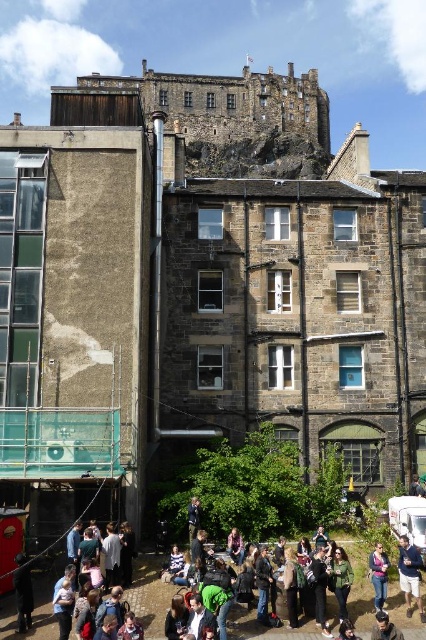
Can you confirm if black leather jacket at lower left is shorter than dark brown hair at lower center?

Incorrect, black leather jacket at lower left's height does not fall short of dark brown hair at lower center's.

Describe the element at coordinates (23, 593) in the screenshot. I see `black leather jacket at lower left` at that location.

Which is behind, point (17, 630) or point (396, 636)?

The point (17, 630) is more distant.

You are a GUI agent. You are given a task and a screenshot of the screen. Output one action in this format:
    pyautogui.click(x=<x>, y=<y>)
    Task: Click on the black leather jacket at lower left
    
    Given the screenshot: What is the action you would take?
    pyautogui.click(x=23, y=593)

Does jeans at lower center lie behind green fabric jacket at lower center?

No, jeans at lower center is closer to the viewer.

From the picture: How distant is jeans at lower center from green fabric jacket at lower center?

The distance of jeans at lower center from green fabric jacket at lower center is 4.35 meters.

Does point (397, 595) come behind point (198, 525)?

No, (397, 595) is closer to viewer.

At what (x,y) coordinates should I click in order to perform the action: click on jeans at lower center. Please return your answer as a coordinate pair (x, y). Looking at the image, I should click on (149, 595).

Which is more to the left, denim jacket at lower right or green fabric jacket at lower center?

green fabric jacket at lower center

Based on the photo, can you confirm if denim jacket at lower right is smaller than green fabric jacket at lower center?

No.

Is point (377, 595) in front of point (195, 509)?

Yes.

Find the location of a particular element. This screenshot has height=640, width=426. denim jacket at lower right is located at coordinates (379, 573).